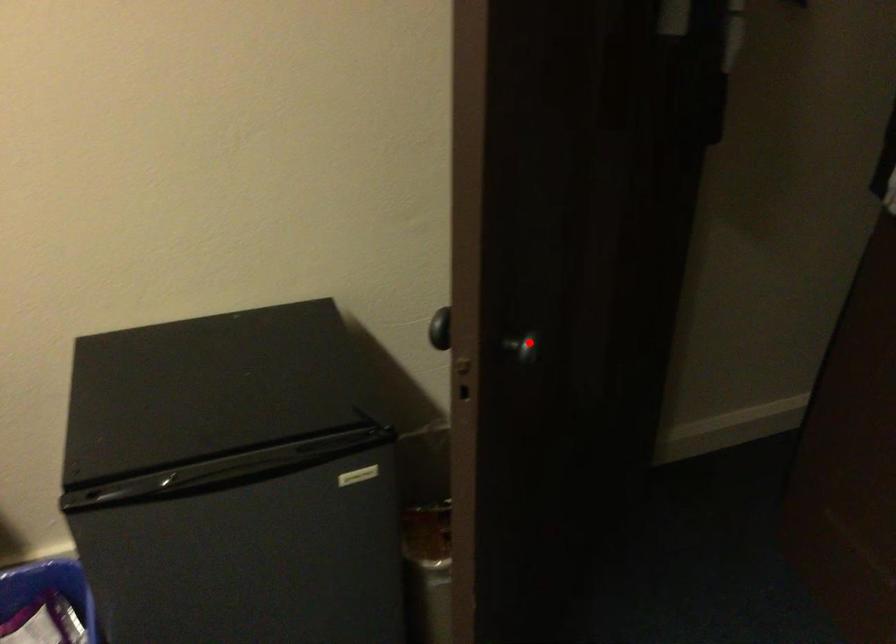
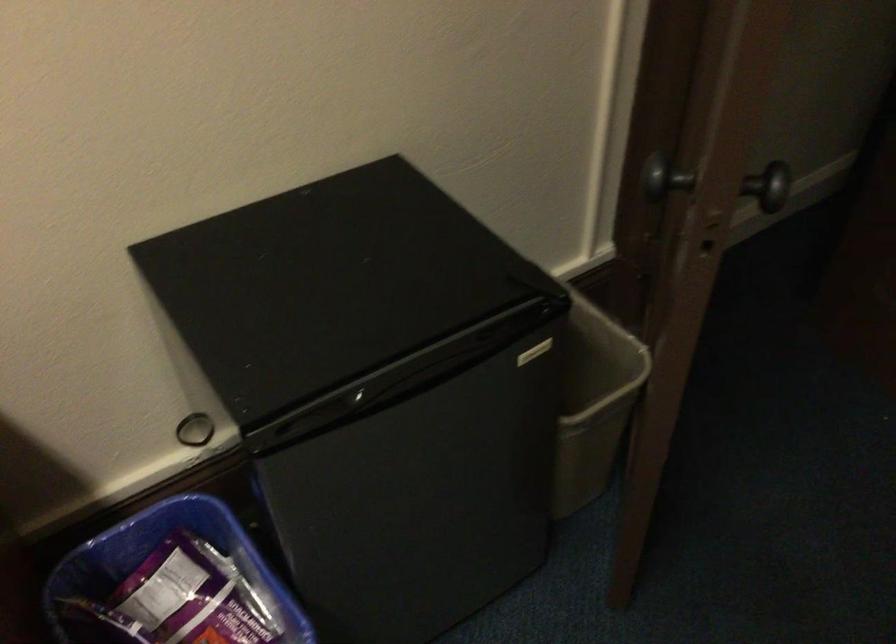
Locate, in the second image, the point that corresponds to the highlighted location in the first image.

(771, 185)